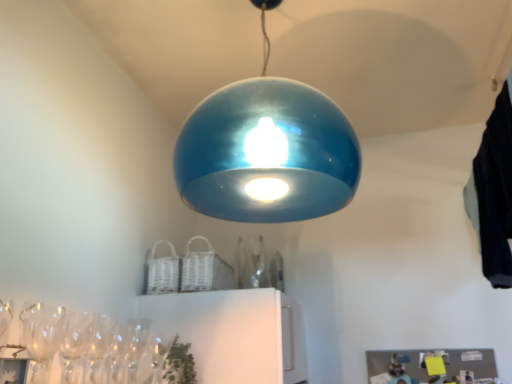
Question: Should I look upward or downward to see clear glass wine glass at lower left?

Choices:
 (A) down
 (B) up

Answer: (A)

Question: From the image's perspective, is dark blue fabric at upper right located beneath clear glass wine glass at lower left?

Choices:
 (A) yes
 (B) no

Answer: (B)

Question: Considering the relative positions of dark blue fabric at upper right and clear glass wine glass at lower left in the image provided, is dark blue fabric at upper right to the right of clear glass wine glass at lower left from the viewer's perspective?

Choices:
 (A) no
 (B) yes

Answer: (B)

Question: Does dark blue fabric at upper right have a lesser width compared to clear glass wine glass at lower left?

Choices:
 (A) no
 (B) yes

Answer: (A)

Question: From the image's perspective, is dark blue fabric at upper right on clear glass wine glass at lower left?

Choices:
 (A) yes
 (B) no

Answer: (A)

Question: From a real-world perspective, is dark blue fabric at upper right below clear glass wine glass at lower left?

Choices:
 (A) yes
 (B) no

Answer: (B)

Question: Could you tell me if dark blue fabric at upper right is facing clear glass wine glass at lower left?

Choices:
 (A) yes
 (B) no

Answer: (B)

Question: Is glossy blue dome at center oriented away from dark blue fabric at upper right?

Choices:
 (A) yes
 (B) no

Answer: (B)

Question: From a real-world perspective, is glossy blue dome at center beneath dark blue fabric at upper right?

Choices:
 (A) yes
 (B) no

Answer: (B)

Question: Is glossy blue dome at center completely or partially outside of dark blue fabric at upper right?

Choices:
 (A) no
 (B) yes

Answer: (B)

Question: Can you confirm if glossy blue dome at center is bigger than dark blue fabric at upper right?

Choices:
 (A) yes
 (B) no

Answer: (A)

Question: Is glossy blue dome at center not close to dark blue fabric at upper right?

Choices:
 (A) yes
 (B) no

Answer: (B)

Question: From the image's perspective, is glossy blue dome at center over dark blue fabric at upper right?

Choices:
 (A) yes
 (B) no

Answer: (A)

Question: Considering the relative sizes of glossy blue dome at center and clear glass wine glass at lower left in the image provided, is glossy blue dome at center thinner than clear glass wine glass at lower left?

Choices:
 (A) yes
 (B) no

Answer: (B)